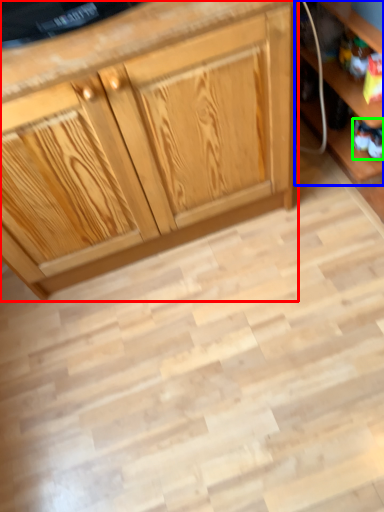
Question: Which object is the farthest from cabinetry (highlighted by a red box)? Choose among these: shelf (highlighted by a blue box) or toy (highlighted by a green box).

Choices:
 (A) shelf
 (B) toy

Answer: (B)